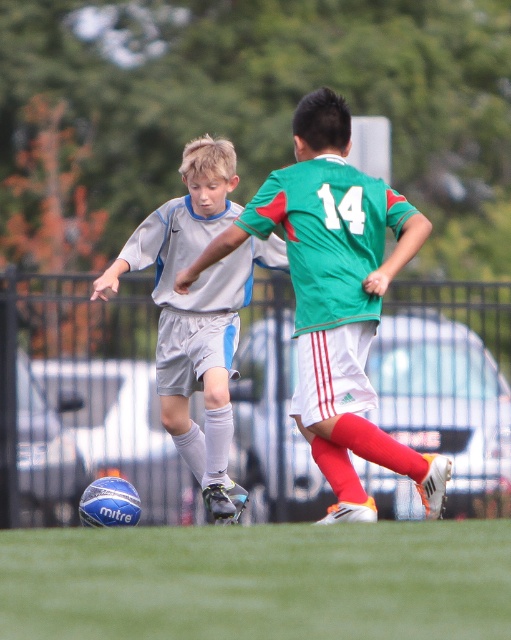
Between green jersey at center and matte white soccer ball at lower left, which one appears on the right side from the viewer's perspective?

green jersey at center

I want to click on green jersey at center, so click(x=336, y=298).

Who is positioned more to the right, green grass at center or matte white soccer ball at lower left?

green grass at center is more to the right.

This screenshot has height=640, width=511. Describe the element at coordinates (259, 580) in the screenshot. I see `green grass at center` at that location.

This screenshot has width=511, height=640. What are the coordinates of `green grass at center` in the screenshot? It's located at pyautogui.click(x=259, y=580).

Between point (207, 620) and point (317, 424), which one is positioned behind?

Point (317, 424)

Based on the photo, is green grass at center wider than green jersey at center?

Yes, green grass at center is wider than green jersey at center.

Does point (269, 536) lie behind point (310, 396)?

That is False.

At what (x,y) coordinates should I click in order to perform the action: click on green grass at center. Please return your answer as a coordinate pair (x, y). The image size is (511, 640). Looking at the image, I should click on (259, 580).